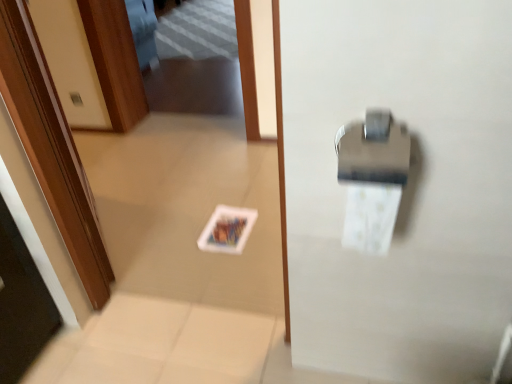
This screenshot has width=512, height=384. Find the location of `wooden screen door at left`. wooden screen door at left is located at coordinates (51, 147).

What do you see at coordinates (51, 147) in the screenshot? I see `wooden screen door at left` at bounding box center [51, 147].

Where is `wooden screen door at left`? This screenshot has height=384, width=512. wooden screen door at left is located at coordinates pyautogui.click(x=51, y=147).